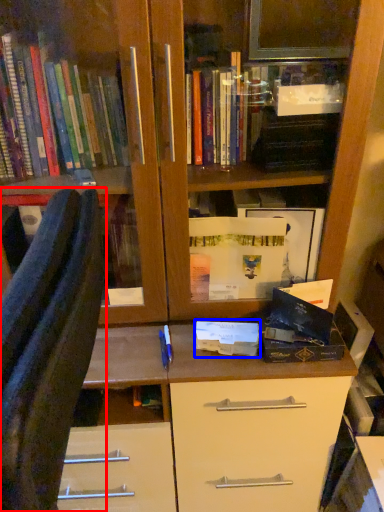
Question: Which point is closer to the camera, furniture (highlighted by a red box) or paperback book (highlighted by a blue box)?

Choices:
 (A) furniture
 (B) paperback book

Answer: (A)